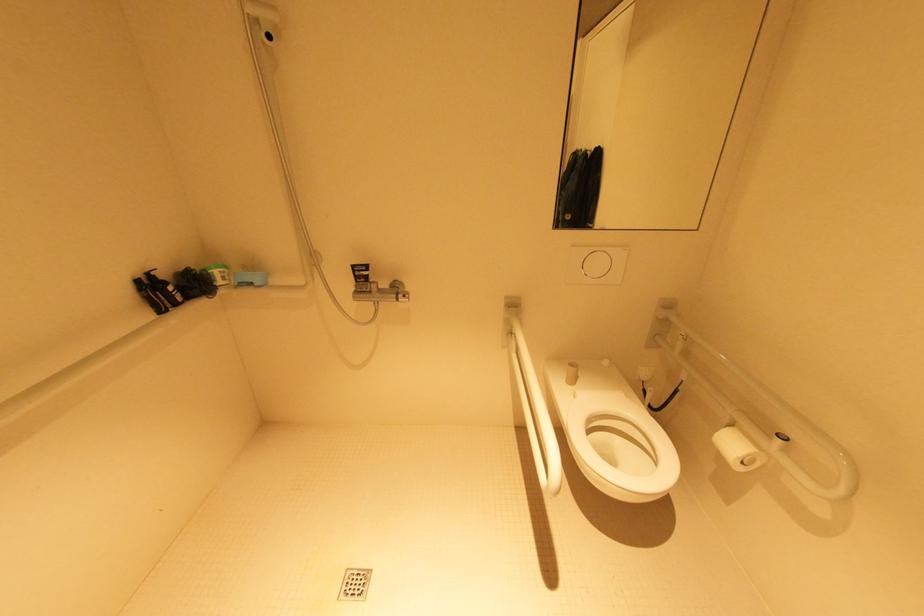
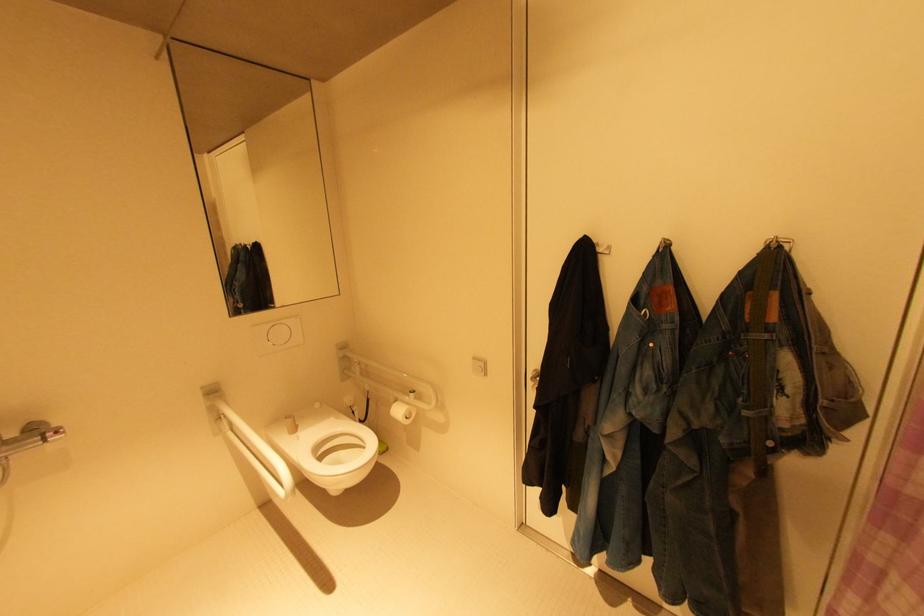
Question: The camera is either moving clockwise (left) or counter-clockwise (right) around the object. The first image is from the beginning of the video and the second image is from the end. Is the camera moving left or right when shooting the video?

Choices:
 (A) Left
 (B) Right

Answer: (A)